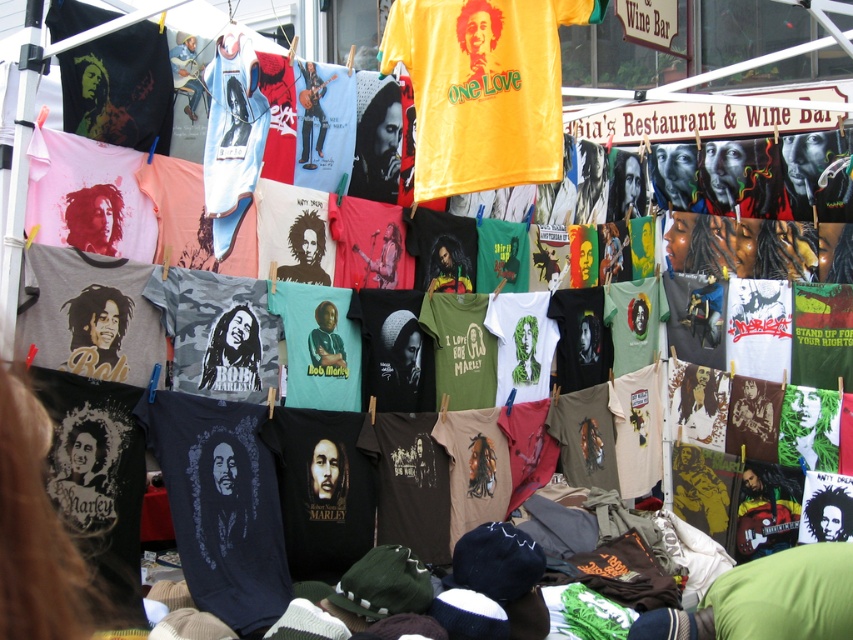
Question: Can you confirm if yellow matte t-shirt at center is positioned below green matte t-shirt at center?

Choices:
 (A) no
 (B) yes

Answer: (A)

Question: Does yellow matte t-shirt at center have a larger size compared to green matte t-shirt at center?

Choices:
 (A) no
 (B) yes

Answer: (B)

Question: Does yellow matte t-shirt at center appear over green matte t-shirt at center?

Choices:
 (A) no
 (B) yes

Answer: (B)

Question: Which point appears farthest from the camera in this image?

Choices:
 (A) (456, 376)
 (B) (457, 6)

Answer: (A)

Question: Which object appears closest to the camera in this image?

Choices:
 (A) green matte t-shirt at center
 (B) yellow matte t-shirt at center

Answer: (B)